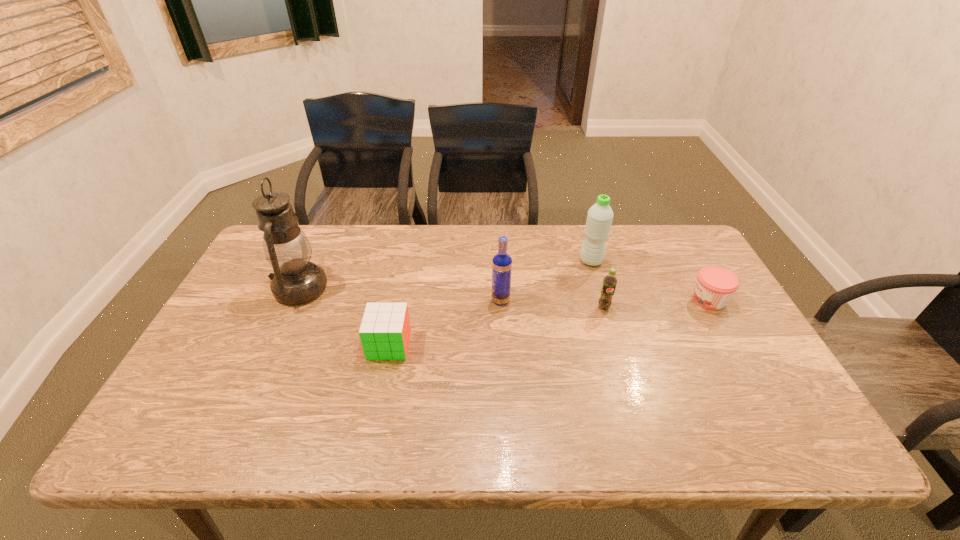
Identify the location of vacant area located 0.310m on the right of the water bottle. (700, 261).

Image resolution: width=960 pixels, height=540 pixels. Find the location of `blank space located on the front of the third object from left to right`. blank space located on the front of the third object from left to right is located at coordinates (505, 384).

Where is `free spot located on the front label of the third shortest object`? free spot located on the front label of the third shortest object is located at coordinates (612, 336).

The image size is (960, 540). What are the coordinates of `free location located on the right of the second object from left to right` in the screenshot? It's located at point(444,345).

Locate an element on the screen. The height and width of the screenshot is (540, 960). free space located 0.220m on the front label of the jam is located at coordinates (614, 300).

Image resolution: width=960 pixels, height=540 pixels. I want to click on vacant space positioned on the front label of the jam, so click(x=652, y=300).

Find the location of a particular element. The height and width of the screenshot is (540, 960). vacant space situated on the front label of the jam is located at coordinates (559, 300).

I want to click on oil lamp that is at the far edge, so pyautogui.click(x=296, y=280).

At what (x,y) coordinates should I click in order to perform the action: click on water bottle at the far edge. Please return your answer as a coordinate pair (x, y). The image size is (960, 540). Looking at the image, I should click on (599, 219).

At what (x,y) coordinates should I click in order to perform the action: click on object that is positioned at the left edge. Please return your answer as a coordinate pair (x, y). The image size is (960, 540). Looking at the image, I should click on (296, 280).